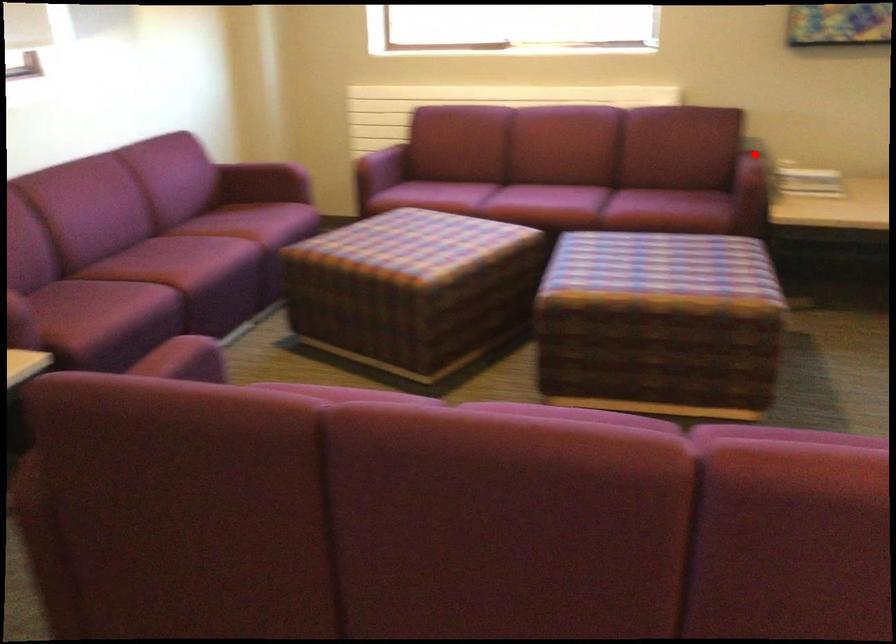
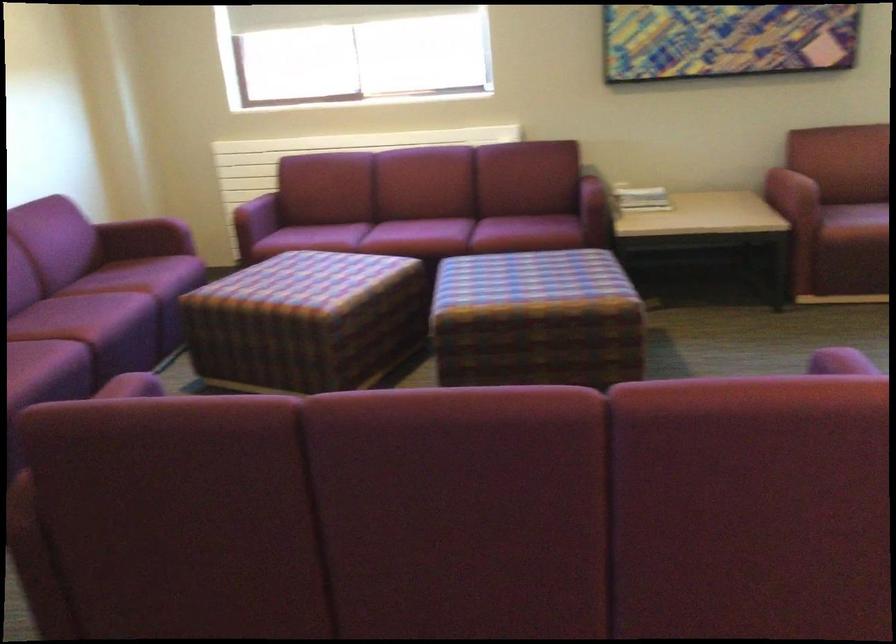
Question: A red point is marked in image1. In image2, is the corresponding 3D point closer to the camera or farther? Reply with the corresponding letter.

Choices:
 (A) The corresponding 3D point is closer.
 (B) The corresponding 3D point is farther.

Answer: (B)